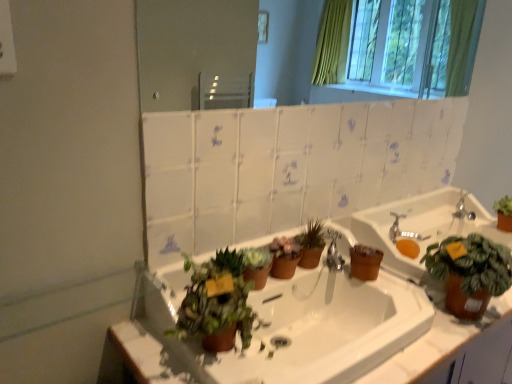
Question: Does silver metallic faucet at upper right have a greater width compared to matte brown pot at center, the 2th houseplant positioned from the right?

Choices:
 (A) yes
 (B) no

Answer: (A)

Question: Considering the relative positions of silver metallic faucet at upper right and matte brown pot at center, the 2th houseplant positioned from the right, in the image provided, is silver metallic faucet at upper right to the right of matte brown pot at center, the 2th houseplant positioned from the right, from the viewer's perspective?

Choices:
 (A) yes
 (B) no

Answer: (A)

Question: Is the depth of silver metallic faucet at upper right less than that of matte brown pot at center, the 2th houseplant positioned from the right?

Choices:
 (A) yes
 (B) no

Answer: (B)

Question: Is silver metallic faucet at upper right thinner than matte brown pot at center, the 2th houseplant positioned from the right?

Choices:
 (A) no
 (B) yes

Answer: (A)

Question: Does silver metallic faucet at upper right have a greater height compared to matte brown pot at center, arranged as the 3th houseplant when viewed from the left?

Choices:
 (A) yes
 (B) no

Answer: (B)

Question: Does silver metallic faucet at upper right contain matte brown pot at center, arranged as the 3th houseplant when viewed from the left?

Choices:
 (A) yes
 (B) no

Answer: (B)

Question: Can you confirm if matte brown sink at right, the 2th sink positioned from the left, is positioned to the right of matte white mirror at upper center?

Choices:
 (A) yes
 (B) no

Answer: (A)

Question: Considering the relative sizes of matte brown sink at right, the 2th sink positioned from the left, and matte white mirror at upper center in the image provided, is matte brown sink at right, the 2th sink positioned from the left, shorter than matte white mirror at upper center?

Choices:
 (A) no
 (B) yes

Answer: (B)

Question: Is matte brown sink at right, the 2th sink positioned from the left, not inside matte white mirror at upper center?

Choices:
 (A) yes
 (B) no

Answer: (A)

Question: Is matte brown sink at right, the 2th sink positioned from the left, oriented away from matte white mirror at upper center?

Choices:
 (A) no
 (B) yes

Answer: (A)

Question: From a real-world perspective, is matte brown sink at right, the first sink viewed from the right, under matte white mirror at upper center?

Choices:
 (A) yes
 (B) no

Answer: (A)

Question: From the image's perspective, would you say matte brown sink at right, the first sink viewed from the right, is positioned over matte white mirror at upper center?

Choices:
 (A) no
 (B) yes

Answer: (A)

Question: Can you confirm if green matte plant at lower center, marked as the first houseplant in a left-to-right arrangement, is smaller than matte white mirror at upper center?

Choices:
 (A) yes
 (B) no

Answer: (B)